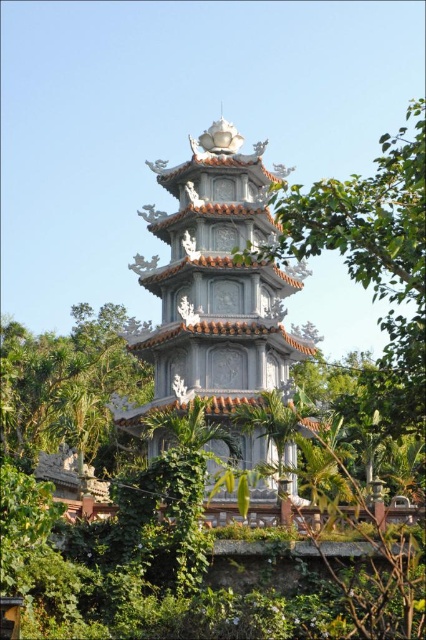
Question: Is white stone pagoda at center smaller than green leafy tree at center?

Choices:
 (A) no
 (B) yes

Answer: (B)

Question: Can you confirm if green leafy tree at center is positioned below green leafy tree at left?

Choices:
 (A) no
 (B) yes

Answer: (A)

Question: Based on their relative distances, which object is nearer to the green leafy tree at left?

Choices:
 (A) green leafy tree at center
 (B) white stone pagoda at center

Answer: (B)

Question: Among these points, which one is farthest from the camera?

Choices:
 (A) pos(379,321)
 (B) pos(11,333)
 (C) pos(264,237)

Answer: (A)

Question: Is green leafy tree at center above green leafy tree at left?

Choices:
 (A) no
 (B) yes

Answer: (B)

Question: Which object appears farthest from the camera in this image?

Choices:
 (A) white stone pagoda at center
 (B) green leafy tree at left
 (C) green leafy tree at center

Answer: (B)